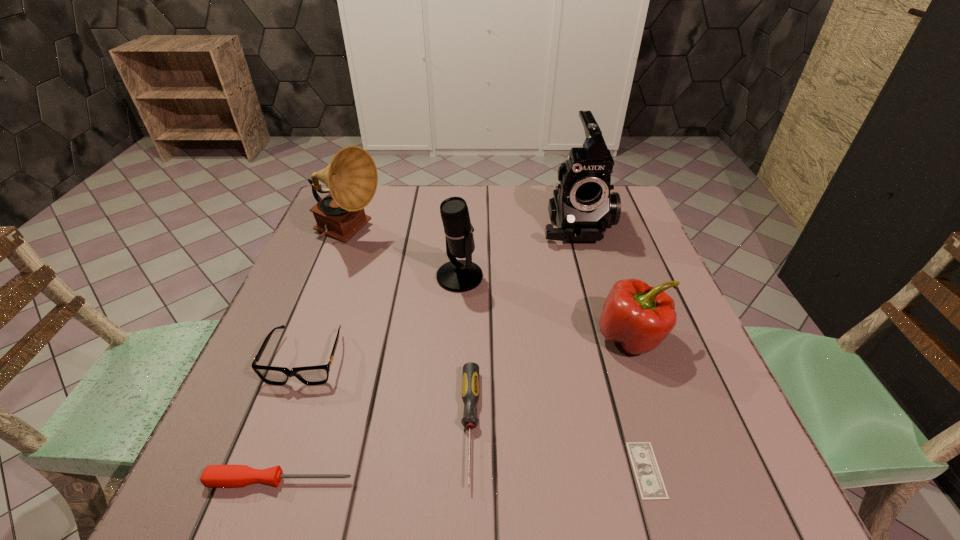
Locate an element on the screen. This screenshot has height=540, width=960. phonograph record present at the left edge is located at coordinates (351, 177).

In order to click on sunglasses present at the left edge in this screenshot , I will do pos(310,375).

Locate an element on the screen. The height and width of the screenshot is (540, 960). screwdriver that is positioned at the left edge is located at coordinates (215, 476).

Image resolution: width=960 pixels, height=540 pixels. Find the location of `camcorder located in the right edge section of the desktop`. camcorder located in the right edge section of the desktop is located at coordinates (582, 206).

Image resolution: width=960 pixels, height=540 pixels. In order to click on pepper at the right edge in this screenshot , I will do `click(639, 317)`.

At what (x,y) coordinates should I click in order to perform the action: click on money located at the right edge. Please return your answer as a coordinate pair (x, y). The width and height of the screenshot is (960, 540). Looking at the image, I should click on (650, 483).

Where is `object situated at the far left corner`? This screenshot has width=960, height=540. object situated at the far left corner is located at coordinates (351, 177).

Where is `object that is at the near left corner`? object that is at the near left corner is located at coordinates (215, 476).

Where is `object positioned at the far right corner`? object positioned at the far right corner is located at coordinates (582, 206).

Identify the location of object present at the near right corner. (650, 483).